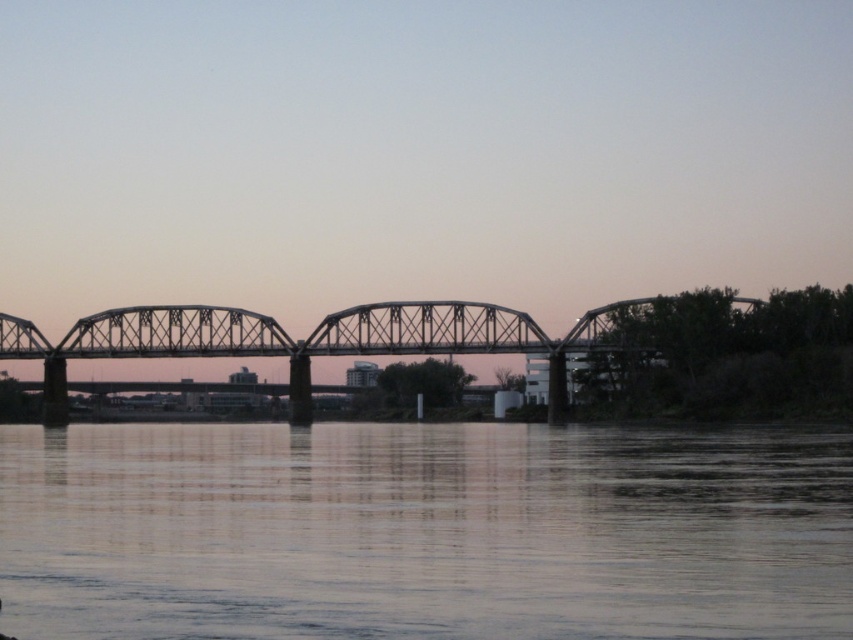
You are standing on the steel truss bridge and want to take a photo of the smooth water at center. Based on its position, where should you aim your camera to capture it?

The smooth water at center is located at point (422, 531), so you should aim your camera towards that coordinate to capture it.

You are an architect analyzing the riverside scene. You need to determine which object occupies more space in the image between the smooth water at center and the metallic bridge at center. Based on the scene, which one is larger?

The smooth water at center is bigger than the metallic bridge at center, so the smooth water at center occupies more space in the image.